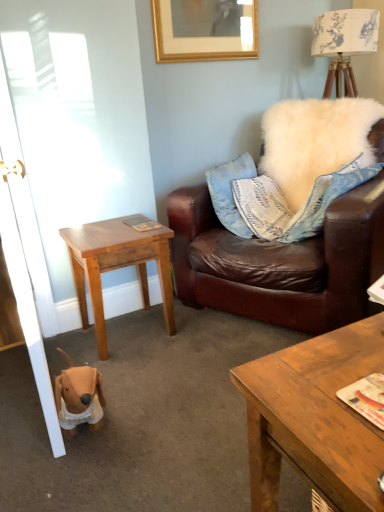
Where is `vacant region below light brown wooden table at lower left (from a real-world perspective)`? vacant region below light brown wooden table at lower left (from a real-world perspective) is located at coordinates tap(137, 328).